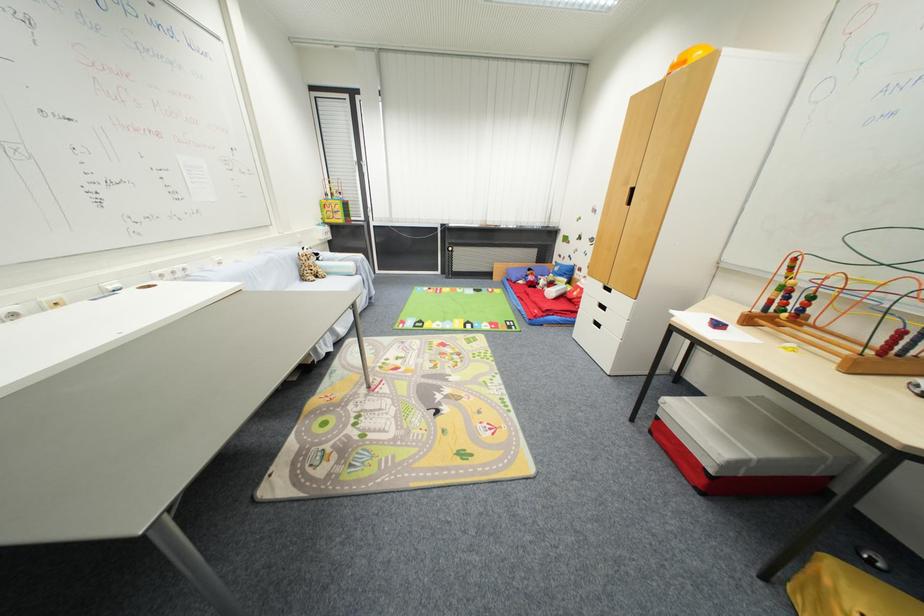
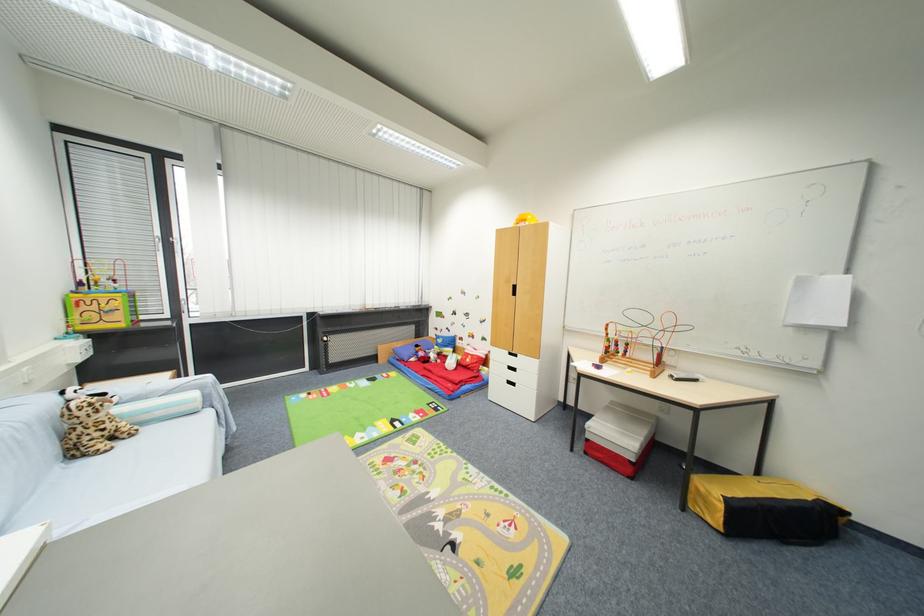
Question: The camera is either moving clockwise (left) or counter-clockwise (right) around the object. The first image is from the beginning of the video and the second image is from the end. Is the camera moving left or right when shooting the video?

Choices:
 (A) Left
 (B) Right

Answer: (A)